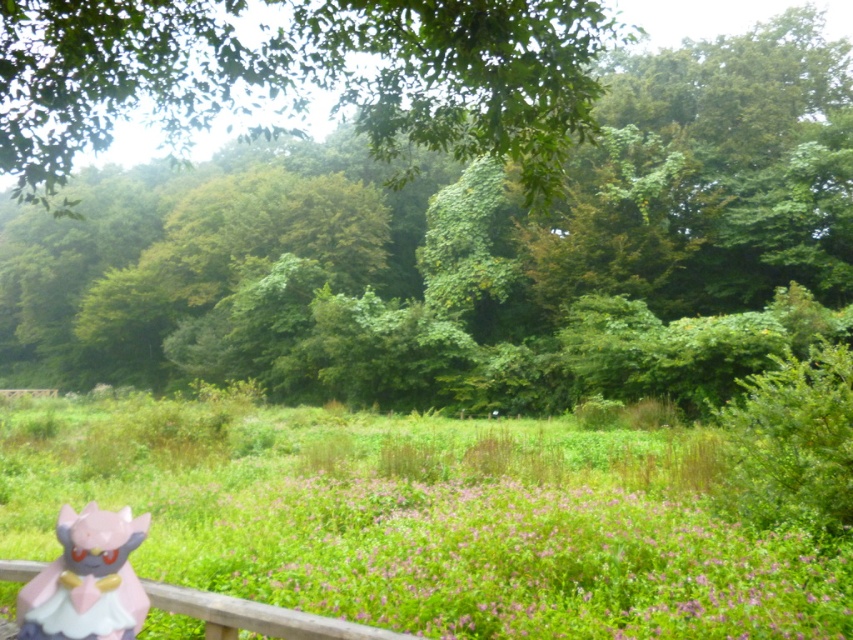
Can you confirm if green leafy tree at center is thinner than green leafy tree at upper center?

No, green leafy tree at center is not thinner than green leafy tree at upper center.

In the scene shown: Who is more distant from viewer, (517,77) or (334,72)?

Point (334,72)

What are the coordinates of `green leafy tree at center` in the screenshot? It's located at (x=427, y=205).

At what (x,y) coordinates should I click in order to perform the action: click on green leafy tree at center. Please return your answer as a coordinate pair (x, y). Looking at the image, I should click on (427, 205).

Is green leafy tree at upper center to the left of wooden at lower left from the viewer's perspective?

Yes, green leafy tree at upper center is to the left of wooden at lower left.

Is green leafy tree at upper center taller than wooden at lower left?

Yes, green leafy tree at upper center is taller than wooden at lower left.

Describe the element at coordinates (300, 76) in the screenshot. I see `green leafy tree at upper center` at that location.

What are the coordinates of `green leafy tree at upper center` in the screenshot? It's located at (300, 76).

Which is below, green leafy tree at center or wooden at lower left?

Positioned lower is wooden at lower left.

Does green leafy tree at center come in front of wooden at lower left?

No, green leafy tree at center is further to the viewer.

The image size is (853, 640). Describe the element at coordinates (427, 205) in the screenshot. I see `green leafy tree at center` at that location.

What are the coordinates of `green leafy tree at center` in the screenshot? It's located at (427, 205).